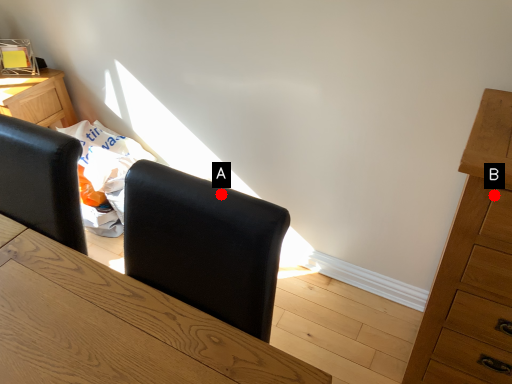
Question: Two points are circled on the image, labeled by A and B beside each circle. Which point is closer to the camera?

Choices:
 (A) A is closer
 (B) B is closer

Answer: (A)